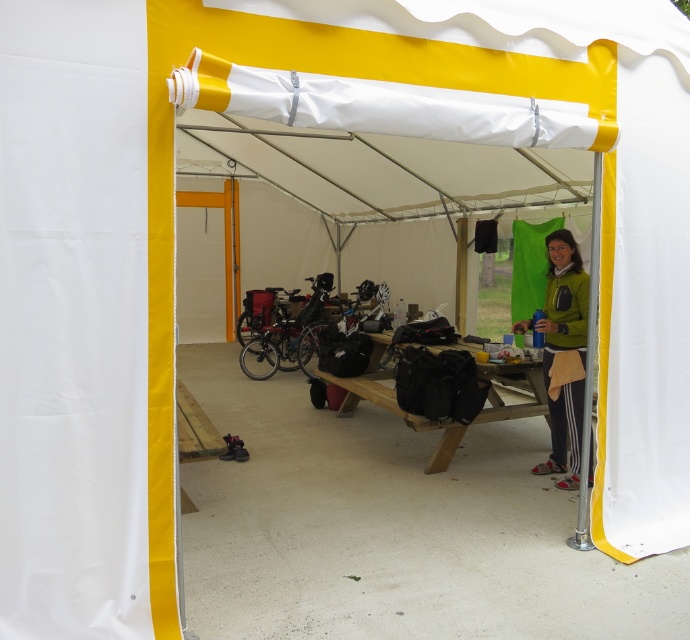
Is the position of green fleece jacket at center less distant than that of wooden picnic table at center?

That is True.

Does point (580, 368) lie in front of point (408, 413)?

Yes, point (580, 368) is closer to viewer.

Identify the location of green fleece jacket at center. This screenshot has width=690, height=640. (562, 353).